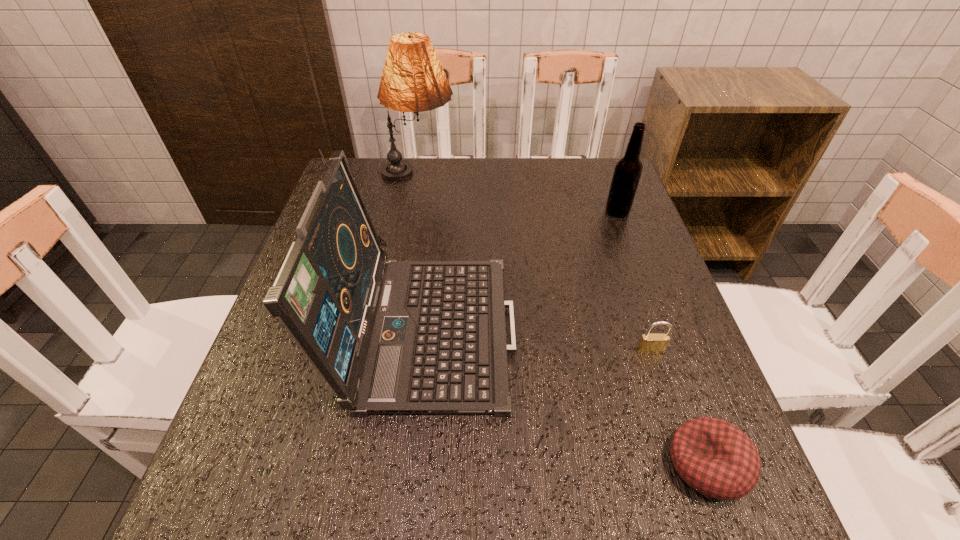
Image resolution: width=960 pixels, height=540 pixels. I want to click on vacant space located on the left of the third tallest object, so click(549, 212).

Where is `vacant space located 0.130m on the front-facing side of the padlock`? The image size is (960, 540). vacant space located 0.130m on the front-facing side of the padlock is located at coordinates (672, 416).

Where is `vacant space located 0.310m on the left of the beanbag`? The width and height of the screenshot is (960, 540). vacant space located 0.310m on the left of the beanbag is located at coordinates (474, 464).

Locate an element on the screen. This screenshot has height=540, width=960. object that is at the far edge is located at coordinates (413, 80).

You are a GUI agent. You are given a task and a screenshot of the screen. Output one action in this format:
    pyautogui.click(x=<x>, y=<y>)
    Task: Click on the object that is at the near edge
    
    Given the screenshot: What is the action you would take?
    pyautogui.click(x=714, y=457)

This screenshot has width=960, height=540. I want to click on lampshade situated at the left edge, so click(x=413, y=80).

What are the coordinates of `laptop computer positioned at the left edge` in the screenshot? It's located at (390, 337).

This screenshot has height=540, width=960. Find the location of `beer bottle that is positioned at the right edge`. beer bottle that is positioned at the right edge is located at coordinates (628, 169).

Where is `padlock present at the right edge`? padlock present at the right edge is located at coordinates (649, 343).

Image resolution: width=960 pixels, height=540 pixels. I want to click on beanbag at the right edge, so click(x=714, y=457).